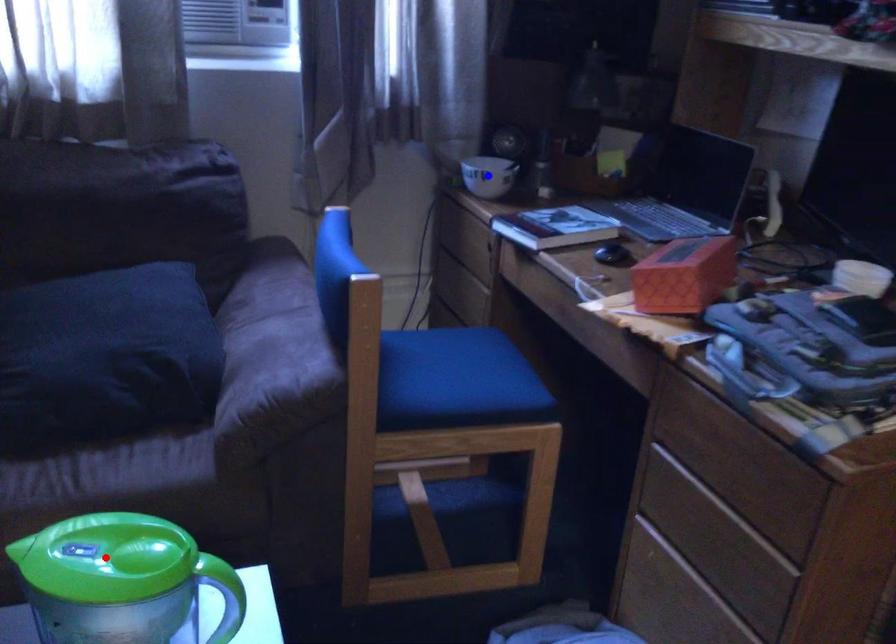
Question: Which of the two points in the image is closer to the camera?

Choices:
 (A) Blue point is closer.
 (B) Red point is closer.

Answer: (B)